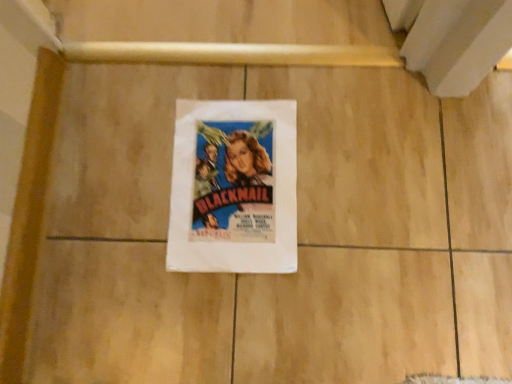
Locate an element on the screen. This screenshot has height=384, width=512. vintage paper poster at center is located at coordinates (234, 188).

This screenshot has height=384, width=512. What do you see at coordinates (234, 188) in the screenshot?
I see `vintage paper poster at center` at bounding box center [234, 188].

I want to click on vintage paper poster at center, so click(x=234, y=188).